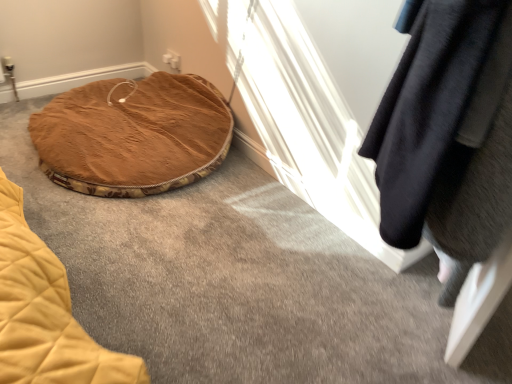
Question: From the image's perspective, is black fuzzy blanket at upper right located beneath brown plush pet bed at lower left?

Choices:
 (A) yes
 (B) no

Answer: (A)

Question: Is black fuzzy blanket at upper right shorter than brown plush pet bed at lower left?

Choices:
 (A) no
 (B) yes

Answer: (A)

Question: Is black fuzzy blanket at upper right wider than brown plush pet bed at lower left?

Choices:
 (A) yes
 (B) no

Answer: (B)

Question: Is black fuzzy blanket at upper right at the right side of brown plush pet bed at lower left?

Choices:
 (A) yes
 (B) no

Answer: (A)

Question: Is black fuzzy blanket at upper right not inside brown plush pet bed at lower left?

Choices:
 (A) yes
 (B) no

Answer: (A)

Question: Is brown plush pet bed at lower left a part of black fuzzy blanket at upper right?

Choices:
 (A) no
 (B) yes

Answer: (A)

Question: Is brown plush pet bed at lower left not inside black fuzzy blanket at upper right?

Choices:
 (A) no
 (B) yes

Answer: (B)

Question: Considering the relative sizes of brown plush pet bed at lower left and black fuzzy blanket at upper right in the image provided, is brown plush pet bed at lower left taller than black fuzzy blanket at upper right?

Choices:
 (A) no
 (B) yes

Answer: (A)

Question: Does brown plush pet bed at lower left have a lesser width compared to black fuzzy blanket at upper right?

Choices:
 (A) yes
 (B) no

Answer: (B)

Question: Is brown plush pet bed at lower left far from black fuzzy blanket at upper right?

Choices:
 (A) no
 (B) yes

Answer: (B)

Question: Is brown plush pet bed at lower left positioned in front of black fuzzy blanket at upper right?

Choices:
 (A) yes
 (B) no

Answer: (B)

Question: Is brown plush pet bed at lower left looking in the opposite direction of black fuzzy blanket at upper right?

Choices:
 (A) yes
 (B) no

Answer: (B)

Question: Does point (111, 125) appear closer or farther from the camera than point (421, 192)?

Choices:
 (A) closer
 (B) farther

Answer: (B)